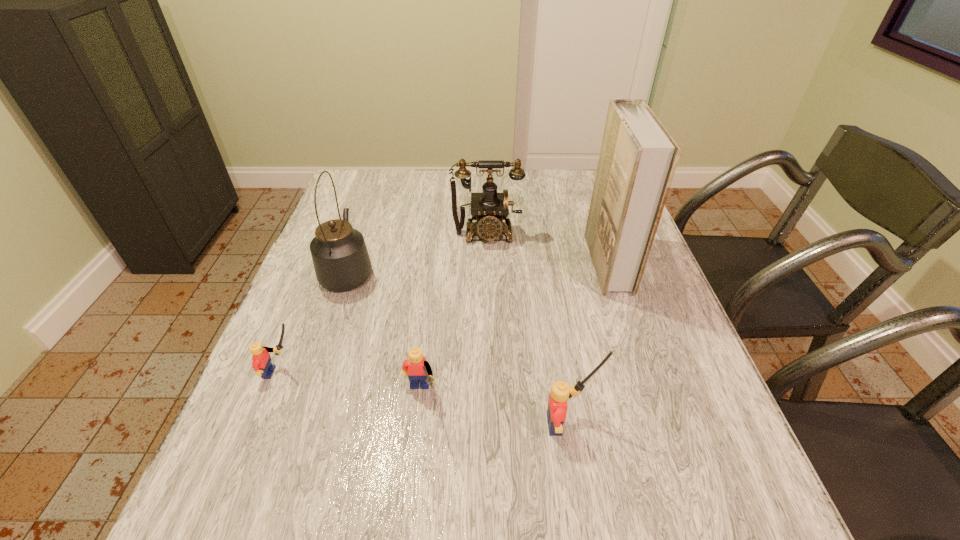
The image size is (960, 540). What are the coordinates of `the shortest object` in the screenshot? It's located at (262, 364).

This screenshot has width=960, height=540. Find the location of `the leftmost Lego`. the leftmost Lego is located at coordinates (262, 364).

Image resolution: width=960 pixels, height=540 pixels. In order to click on the third object from left to right in this screenshot , I will do `click(419, 370)`.

Locate an element on the screen. This screenshot has height=540, width=960. the second tallest Lego is located at coordinates (419, 370).

Image resolution: width=960 pixels, height=540 pixels. I want to click on the fifth object from left to right, so click(560, 392).

The image size is (960, 540). In order to click on the rightmost object in this screenshot , I will do `click(638, 158)`.

This screenshot has width=960, height=540. In order to click on phonebook in this screenshot , I will do `click(638, 158)`.

What are the coordinates of `the fourth shortest object` in the screenshot? It's located at (489, 208).

The height and width of the screenshot is (540, 960). What are the coordinates of `the fourth object from left to right` in the screenshot? It's located at (489, 208).

This screenshot has width=960, height=540. Find the location of `the second tallest object`. the second tallest object is located at coordinates (341, 261).